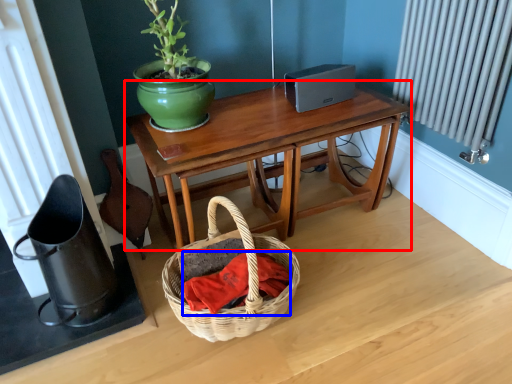
Question: Which of the following is the farthest to the observer, table (highlighted by a red box) or material (highlighted by a blue box)?

Choices:
 (A) table
 (B) material

Answer: (A)